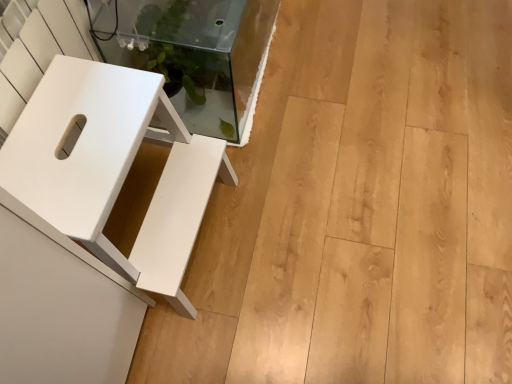
At what (x,y) coordinates should I click in order to perform the action: click on white matte stool at left. Please return your answer as a coordinate pair (x, y). Looking at the image, I should click on (112, 168).

What do you see at coordinates (112, 168) in the screenshot?
I see `white matte stool at left` at bounding box center [112, 168].

Measure the distance between white matte stool at left and camera.

The depth of white matte stool at left is 27.80 inches.

This screenshot has width=512, height=384. Find the location of `transparent glass table at upper left`. transparent glass table at upper left is located at coordinates (193, 53).

Measure the distance between transparent glass table at upper left and camera.

transparent glass table at upper left is 1.02 meters away from camera.

What do you see at coordinates (193, 53) in the screenshot?
I see `transparent glass table at upper left` at bounding box center [193, 53].

Where is `white matte stool at left`? The width and height of the screenshot is (512, 384). white matte stool at left is located at coordinates (112, 168).

Which object is positioned more to the right, white matte stool at left or transparent glass table at upper left?

transparent glass table at upper left is more to the right.

Considering the positions of objects white matte stool at left and transparent glass table at upper left in the image provided, who is behind, white matte stool at left or transparent glass table at upper left?

transparent glass table at upper left is more distant.

Which point is more forward, (161, 115) or (198, 88)?

The point (161, 115) is in front.

From the image's perspective, is white matte stool at left positioned above or below transparent glass table at upper left?

white matte stool at left is situated lower than transparent glass table at upper left in the image.

From a real-world perspective, is white matte stool at left physically located above or below transparent glass table at upper left?

white matte stool at left is above transparent glass table at upper left.

Does white matte stool at left have a greater width compared to transparent glass table at upper left?

Yes, white matte stool at left is wider than transparent glass table at upper left.

Is white matte stool at left taller or shorter than transparent glass table at upper left?

white matte stool at left is taller than transparent glass table at upper left.

Who is bigger, white matte stool at left or transparent glass table at upper left?

transparent glass table at upper left.

Is white matte stool at left positioned beyond the bounds of transparent glass table at upper left?

white matte stool at left is positioned outside transparent glass table at upper left.

Would you consider white matte stool at left to be distant from transparent glass table at upper left?

No, white matte stool at left is not far from transparent glass table at upper left.

Is white matte stool at left facing towards transparent glass table at upper left?

No, white matte stool at left does not turn towards transparent glass table at upper left.

Locate an element on the screen. glass table that is above the white matte stool at left (from the image's perspective) is located at coordinates (193, 53).

Is transparent glass table at upper left at the right side of white matte stool at left?

Yes.

In the scene shown: Is transparent glass table at upper left in front of or behind white matte stool at left in the image?

transparent glass table at upper left is positioned farther from the viewer than white matte stool at left.

Does point (189, 46) appear closer or farther from the camera than point (84, 201)?

Clearly, point (189, 46) is more distant from the camera than point (84, 201).

From the image's perspective, is transparent glass table at upper left above white matte stool at left?

Yes, from the image's perspective, transparent glass table at upper left is on top of white matte stool at left.

From a real-world perspective, is transparent glass table at upper left under white matte stool at left?

Yes, from a real-world perspective, transparent glass table at upper left is below white matte stool at left.

Is transparent glass table at upper left wider or thinner than white matte stool at left?

In the image, transparent glass table at upper left appears to be more narrow than white matte stool at left.

Does transparent glass table at upper left have a greater height compared to white matte stool at left?

In fact, transparent glass table at upper left may be shorter than white matte stool at left.

Is transparent glass table at upper left bigger than white matte stool at left?

Indeed, transparent glass table at upper left has a larger size compared to white matte stool at left.

Would you say white matte stool at left is part of transparent glass table at upper left's contents?

No, white matte stool at left is not inside transparent glass table at upper left.

Is transparent glass table at upper left placed right next to white matte stool at left?

No, transparent glass table at upper left is not beside white matte stool at left.

Consider the image. Is transparent glass table at upper left oriented towards white matte stool at left?

No, transparent glass table at upper left is not facing towards white matte stool at left.

Looking at this image, how many degrees apart are the facing directions of transparent glass table at upper left and white matte stool at left?

The angular difference between transparent glass table at upper left and white matte stool at left is 1.15 degrees.

In the image, there is a transparent glass table at upper left. Identify the location of furniture below it (from the image's perspective). Image resolution: width=512 pixels, height=384 pixels. (112, 168).

Identify the location of glass table that is behind the white matte stool at left. This screenshot has height=384, width=512. (193, 53).

The width and height of the screenshot is (512, 384). Find the location of `furniture located above the transparent glass table at upper left (from a real-world perspective)`. furniture located above the transparent glass table at upper left (from a real-world perspective) is located at coordinates (112, 168).